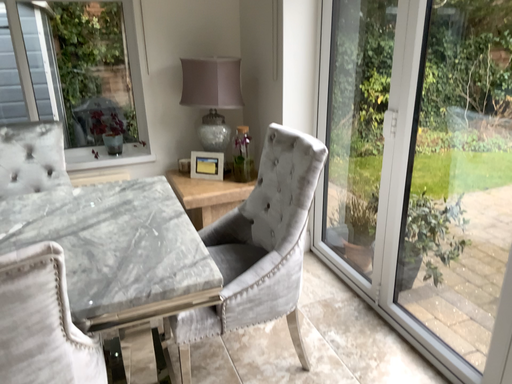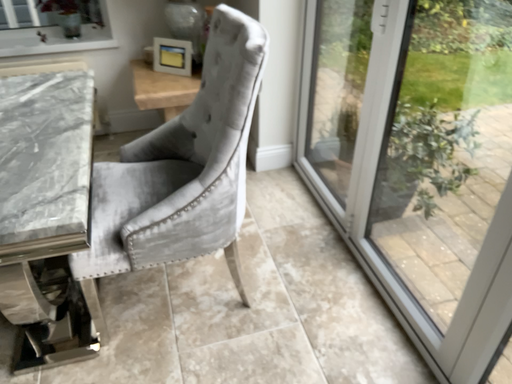
Question: Which way did the camera rotate in the video?

Choices:
 (A) rotated downward
 (B) rotated upward

Answer: (A)